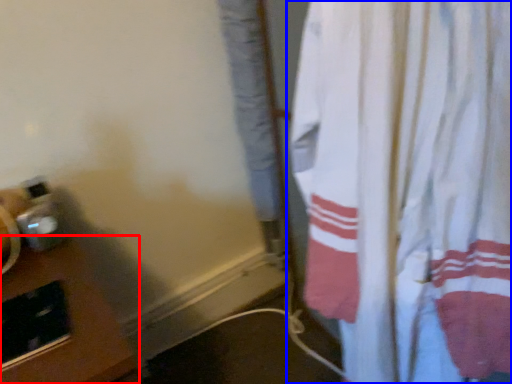
Question: Among these objects, which one is nearest to the camera, table (highlighted by a red box) or curtain (highlighted by a blue box)?

Choices:
 (A) table
 (B) curtain

Answer: (B)